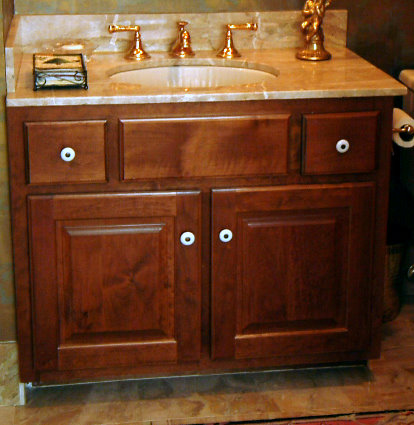
Locate an element on the screen. The height and width of the screenshot is (425, 414). floor is located at coordinates (237, 396).